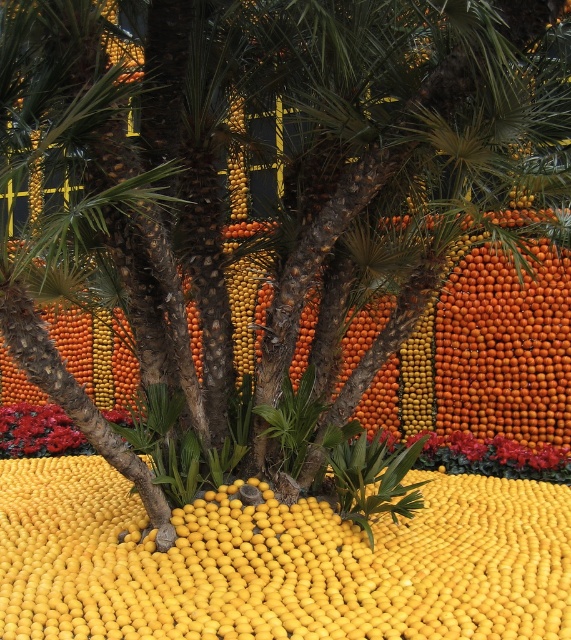
Locate an element on the screen. yellow matte lemon at center is located at coordinates click(x=279, y=563).

Is yellow matte lemon at center thinner than shiny red petals at lower left?

In fact, yellow matte lemon at center might be wider than shiny red petals at lower left.

This screenshot has height=640, width=571. Find the location of `yellow matte lemon at center`. yellow matte lemon at center is located at coordinates (279, 563).

The width and height of the screenshot is (571, 640). In order to click on yellow matte lemon at center in this screenshot , I will do `click(279, 563)`.